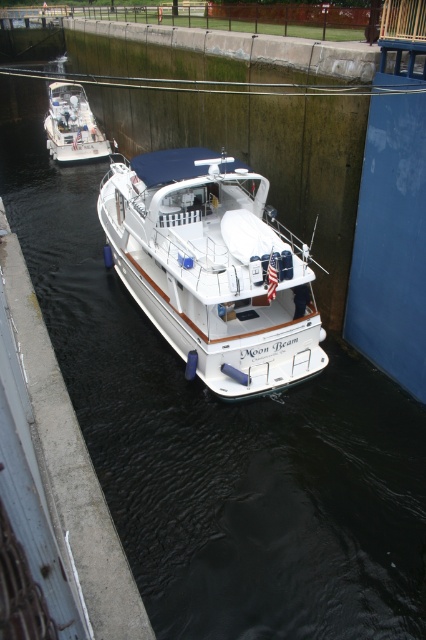
Question: Can you confirm if white glossy boat at center is positioned above white glossy boat at upper left?

Choices:
 (A) yes
 (B) no

Answer: (B)

Question: Can you confirm if white glossy boat at center is thinner than white glossy boat at upper left?

Choices:
 (A) yes
 (B) no

Answer: (B)

Question: Which of the following is the farthest from the observer?

Choices:
 (A) (175, 192)
 (B) (71, 160)

Answer: (B)

Question: Which of the following is the farthest from the observer?

Choices:
 (A) (216, 385)
 (B) (80, 157)

Answer: (B)

Question: Among these objects, which one is farthest from the camera?

Choices:
 (A) white glossy boat at center
 (B) white glossy boat at upper left

Answer: (B)

Question: Is white glossy boat at center smaller than white glossy boat at upper left?

Choices:
 (A) yes
 (B) no

Answer: (B)